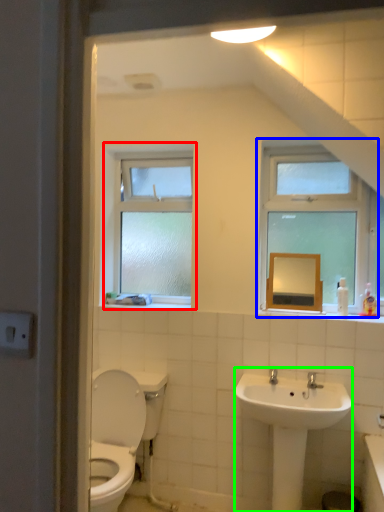
Question: Which is nearer to the window (highlighted by a red box)? window (highlighted by a blue box) or sink (highlighted by a green box).

Choices:
 (A) window
 (B) sink

Answer: (A)